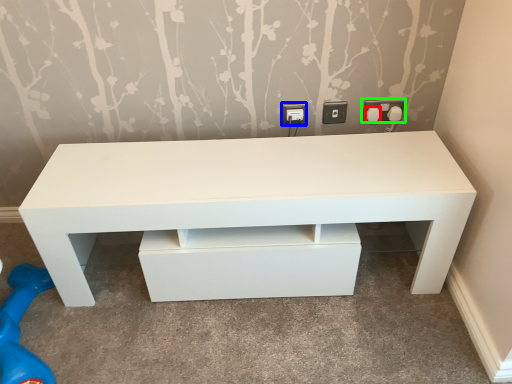
Question: Estimate the real-world distances between objects in this image. Which object is farther from knob (highlighted by a red box), electric outlet (highlighted by a blue box) or electric outlet (highlighted by a green box)?

Choices:
 (A) electric outlet
 (B) electric outlet

Answer: (A)